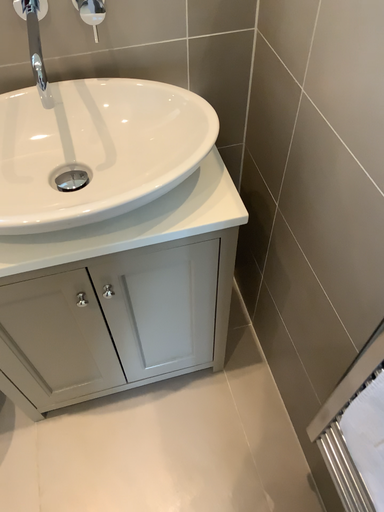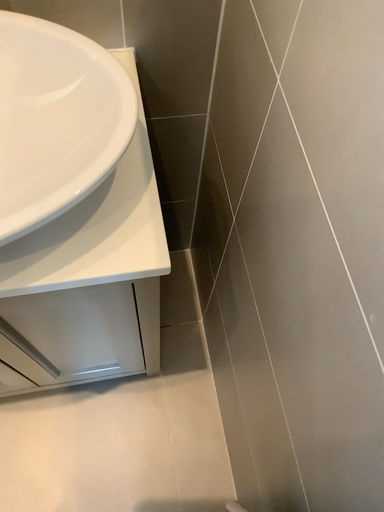
Question: Which way did the camera rotate in the video?

Choices:
 (A) rotated upward
 (B) rotated downward

Answer: (B)